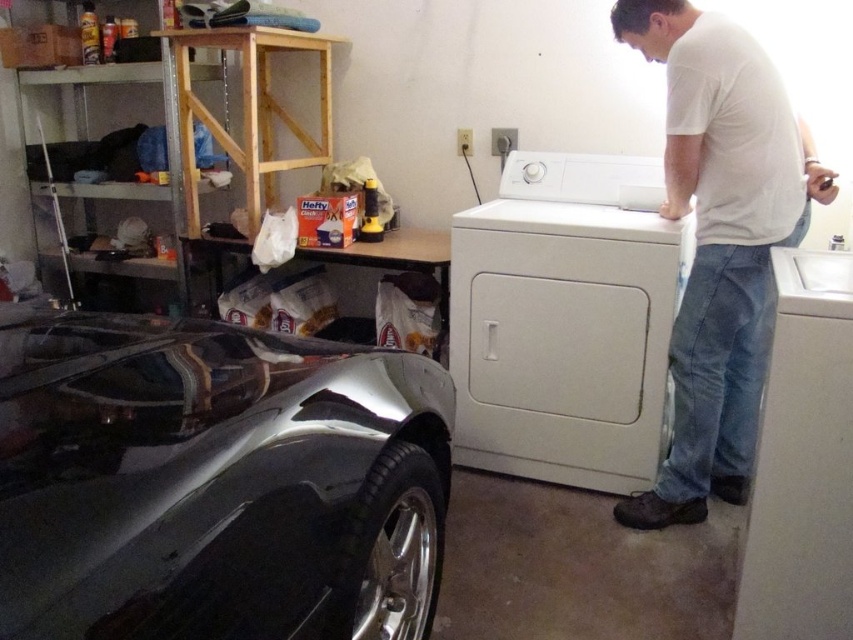
Between glossy metallic car at lower left and white cotton shirt at upper right, which one is positioned higher?

white cotton shirt at upper right

Can you confirm if glossy metallic car at lower left is thinner than white cotton shirt at upper right?

In fact, glossy metallic car at lower left might be wider than white cotton shirt at upper right.

Which is in front, point (258, 461) or point (660, 51)?

Point (258, 461)

In order to click on glossy metallic car at lower left in this screenshot , I will do `click(215, 481)`.

Can you confirm if white matte washing machine at center is bigger than white cotton shirt at upper right?

Correct, white matte washing machine at center is larger in size than white cotton shirt at upper right.

Is point (560, 369) closer to camera compared to point (737, 243)?

No, it is not.

Between point (518, 246) and point (682, 166), which one is positioned in front?

Positioned in front is point (682, 166).

Where is `white matte washing machine at center`? The image size is (853, 640). white matte washing machine at center is located at coordinates (566, 321).

Is point (263, 397) positioned before point (525, 461)?

That is True.

Is glossy metallic car at lower left behind white matte washing machine at center?

No, it is in front of white matte washing machine at center.

Between point (381, 422) and point (589, 400), which one is positioned in front?

Positioned in front is point (381, 422).

Where is `glossy metallic car at lower left`? The width and height of the screenshot is (853, 640). glossy metallic car at lower left is located at coordinates (215, 481).